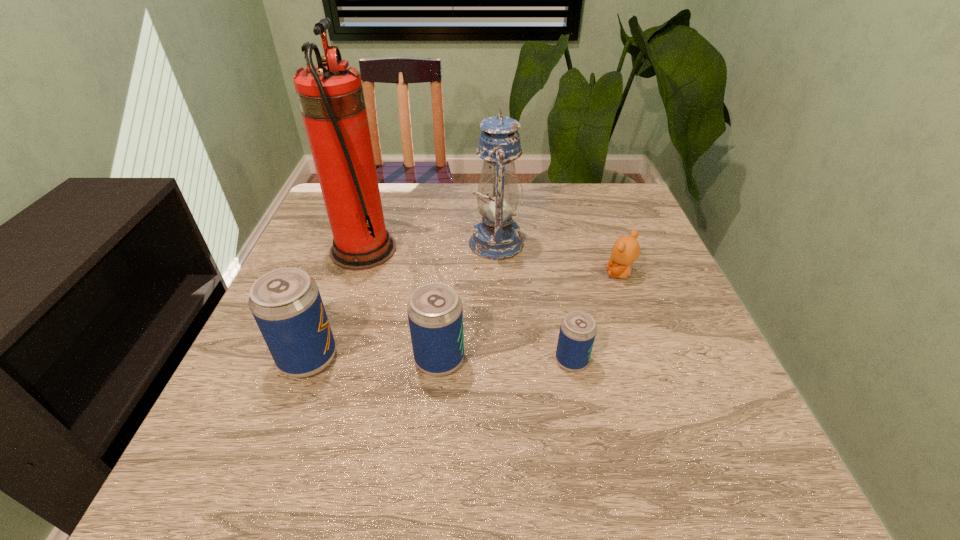
This screenshot has width=960, height=540. Identify the location of beer can that can be found as the third closest to the tallest object. (577, 333).

This screenshot has width=960, height=540. What are the coordinates of `blank area in the image that satisfies the following two spatial constraints: 1. at the discharge end of the second beer can from right to left; 2. on the right side of the tallest object` in the screenshot? It's located at (327, 360).